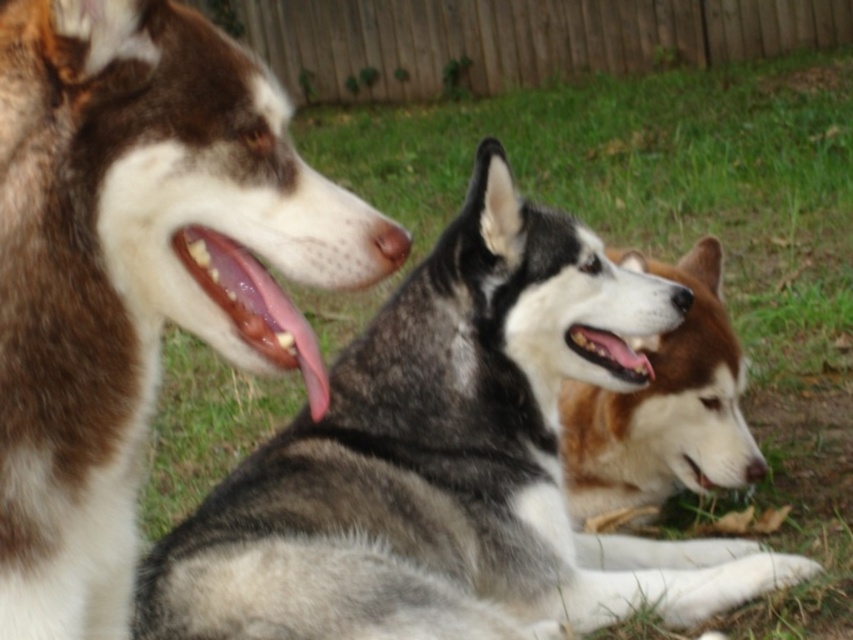
Looking at the three huskies in the backyard, you notice the brown fur dog at left and the pink glossy tongue at center. Based on their positions, which one is higher up in the image?

The brown fur dog at left is above the pink glossy tongue at center, so it is higher up in the image.

You are a photographer trying to capture a group photo of the three Siberian Huskies. You want to position your camera exactly at the center point between the gray fur husky at center and the middle dog. What are the coordinates of this center point?

The coordinates of the center point between the gray fur husky at center and the middle dog would be the average of their positions. Since the gray fur husky at center is at point (447,465), and the middle dog is at an unknown position, we cannot calculate the exact coordinates without additional information.

You are a photographer trying to capture a group photo of the brown fur dog at left and the brown fur dog at center. If your camera has a maximum focus range of 5 feet, will you be able to get both dogs in focus at the same time?

The brown fur dog at left is 5.49 feet from the brown fur dog at center, which exceeds the camera maximum focus range of 5 feet. Therefore, you cannot get both dogs in focus at the same time.